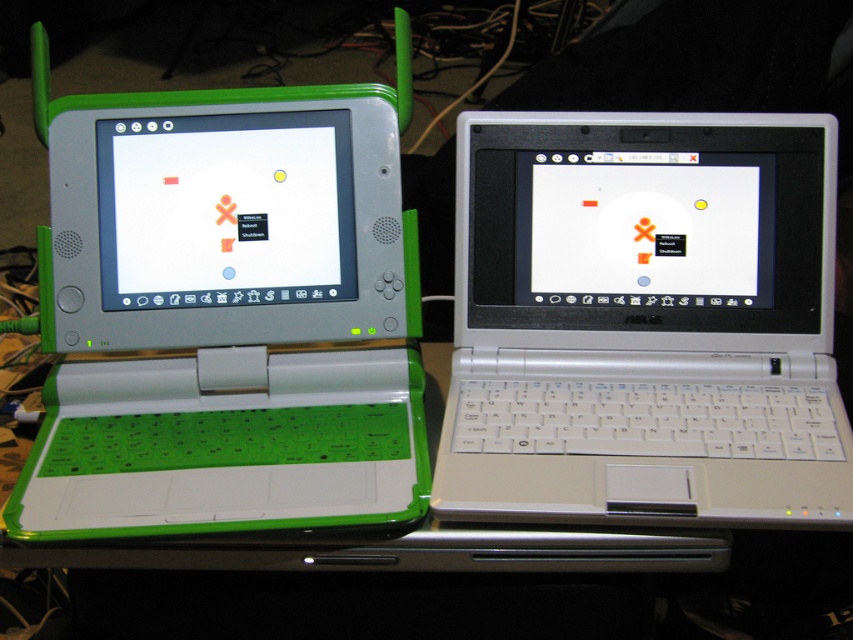
Question: Can you confirm if green matte laptop at left is wider than green matte screen at left?

Choices:
 (A) no
 (B) yes

Answer: (B)

Question: Among these points, which one is nearest to the camera?

Choices:
 (A) (410, 268)
 (B) (631, 141)

Answer: (B)

Question: In this image, where is green matte laptop at left located relative to green matte screen at left?

Choices:
 (A) right
 (B) left

Answer: (B)

Question: Is green matte laptop at left positioned at the back of green matte screen at left?

Choices:
 (A) no
 (B) yes

Answer: (A)

Question: Which of the following is the farthest from the observer?

Choices:
 (A) (233, 268)
 (B) (206, 99)

Answer: (B)

Question: Which point is farther to the camera?

Choices:
 (A) white plastic laptop at center
 (B) green matte laptop at left
 (C) green matte screen at left

Answer: (C)